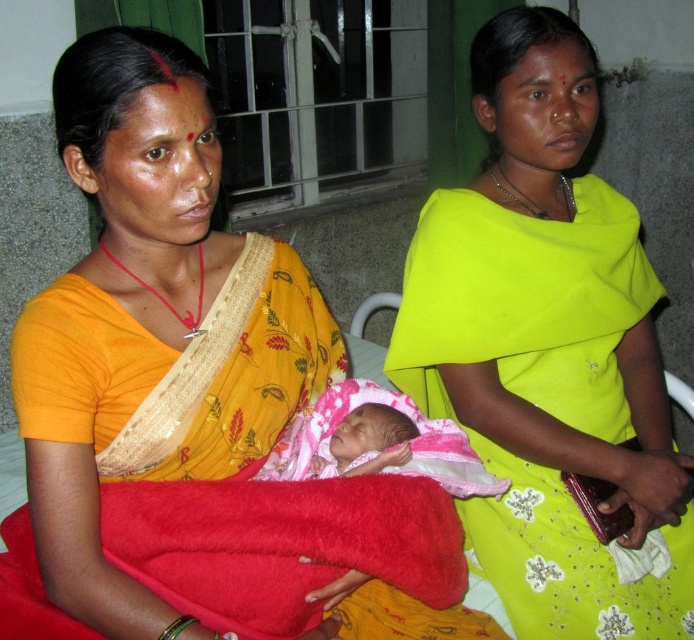
You are a nurse in a hospital room and need to place a medical chart on the bed between the matte yellow sari at center and the pink fabric newborn at center. Is there enough space between them to place the chart?

The matte yellow sari at center is positioned on the right side of the pink fabric newborn at center, so there is space between them to place the medical chart.

Looking at this image, you are a photographer taking a picture of two women wearing yellow saris in a hospital room. The women are seated next to each other. Which woman is wearing the matte yellow sari at center and which is wearing the matte yellow sari at left?

The matte yellow sari at center is worn by the woman on the right side, while the matte yellow sari at left is worn by the woman on the left side.

Based on the photo, you are a nurse in a hospital room. You need to place a medical chart on the bed between the matte yellow sari at left and the pink fabric newborn at center. Based on their positions, which object should the chart be placed closer to?

The matte yellow sari at left is above the pink fabric newborn at center, so the medical chart should be placed closer to the pink fabric newborn at center to ensure it is below the sari and within reach.